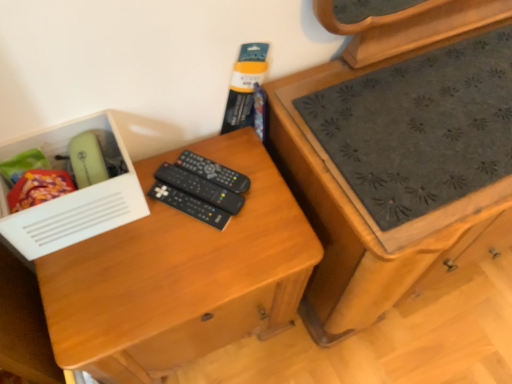
The width and height of the screenshot is (512, 384). Find the location of `free space to the right of black plastic remote controls at center, which ranks as the 1th remote control in bottom-to-top order`. free space to the right of black plastic remote controls at center, which ranks as the 1th remote control in bottom-to-top order is located at coordinates (264, 226).